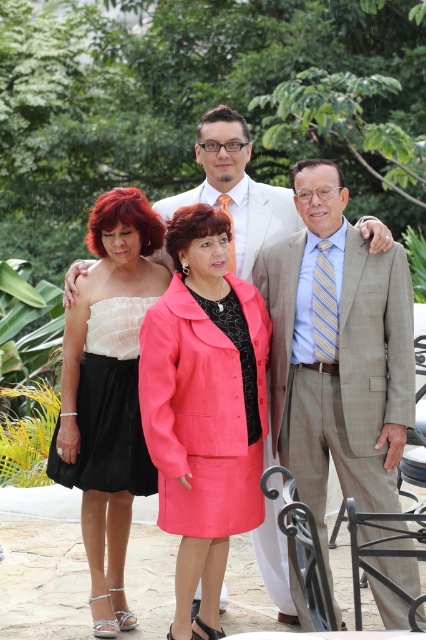
Does light brown textured suit at center have a larger size compared to black satin skirt at lower left?

Indeed, light brown textured suit at center has a larger size compared to black satin skirt at lower left.

Does light brown textured suit at center appear on the right side of black satin skirt at lower left?

Indeed, light brown textured suit at center is positioned on the right side of black satin skirt at lower left.

Which is in front, point (250, 244) or point (120, 422)?

Positioned in front is point (120, 422).

Find the location of a particular element. light brown textured suit at center is located at coordinates (236, 189).

Can you confirm if coral fabric coat at center is positioned above matte white strapless top at left?

Incorrect, coral fabric coat at center is not positioned above matte white strapless top at left.

Is coral fabric coat at center closer to camera compared to matte white strapless top at left?

Yes, it is.

Which is in front, point (245, 472) or point (121, 454)?

Point (245, 472) is more forward.

The height and width of the screenshot is (640, 426). Identify the location of coral fabric coat at center. (204, 406).

Does matte white strapless top at left have a greater width compared to black satin skirt at lower left?

Yes, matte white strapless top at left is wider than black satin skirt at lower left.

Which is in front, point (95, 344) or point (134, 307)?

Point (95, 344) is in front.

Find the location of a particular element. matte white strapless top at left is located at coordinates (109, 392).